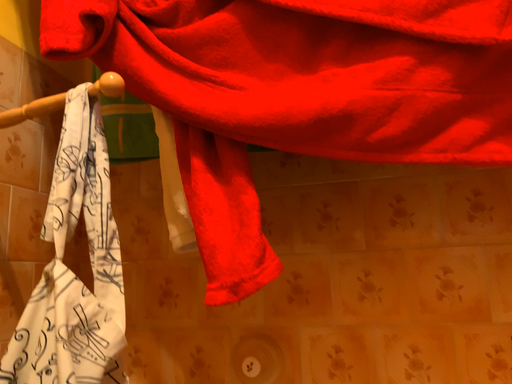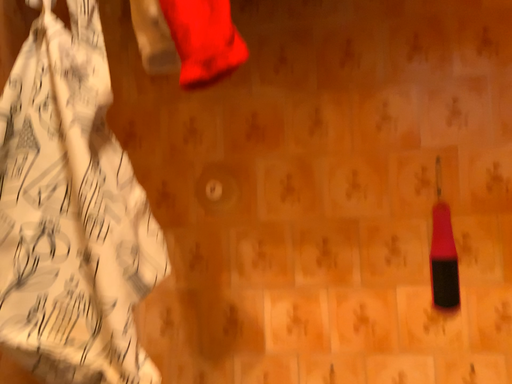
Question: Which way did the camera rotate in the video?

Choices:
 (A) rotated left
 (B) rotated right

Answer: (B)